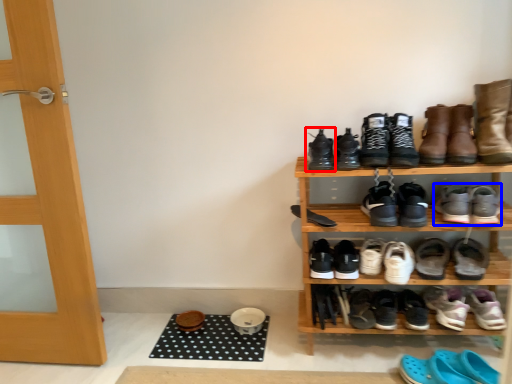
Question: Which object is further to the camera taking this photo, footwear (highlighted by a red box) or footwear (highlighted by a blue box)?

Choices:
 (A) footwear
 (B) footwear

Answer: (A)